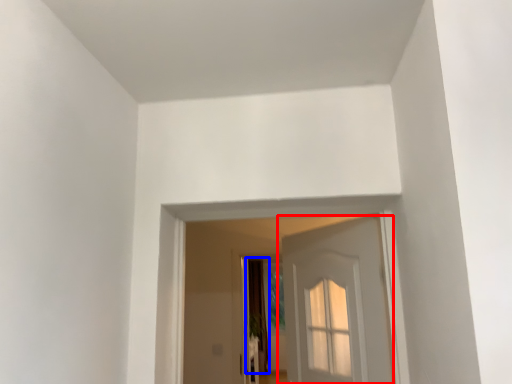
Question: Which object appears closest to the camera in this image, door (highlighted by a red box) or curtain (highlighted by a blue box)?

Choices:
 (A) door
 (B) curtain

Answer: (A)